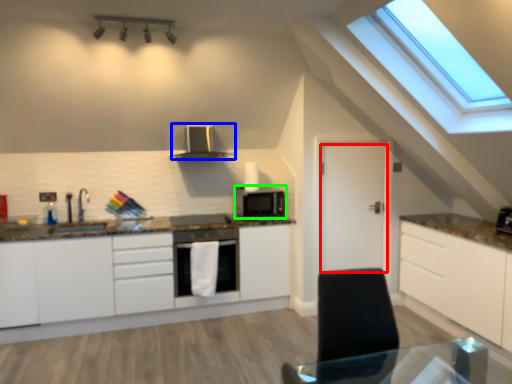
Question: Which object is the farthest from door (highlighted by a red box)? Choose among these: kitchen appliance (highlighted by a blue box) or microwave oven (highlighted by a green box).

Choices:
 (A) kitchen appliance
 (B) microwave oven

Answer: (A)